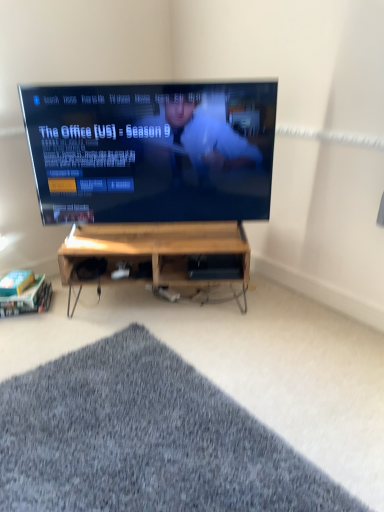
Where is `vacant space to the right of woodenmaterial/texturedesk at center`? vacant space to the right of woodenmaterial/texturedesk at center is located at coordinates (283, 324).